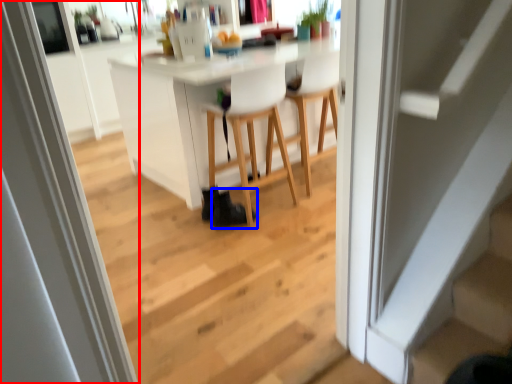
Question: Which object is closer to the camera taking this photo, screen door (highlighted by a red box) or shoe (highlighted by a blue box)?

Choices:
 (A) screen door
 (B) shoe

Answer: (A)